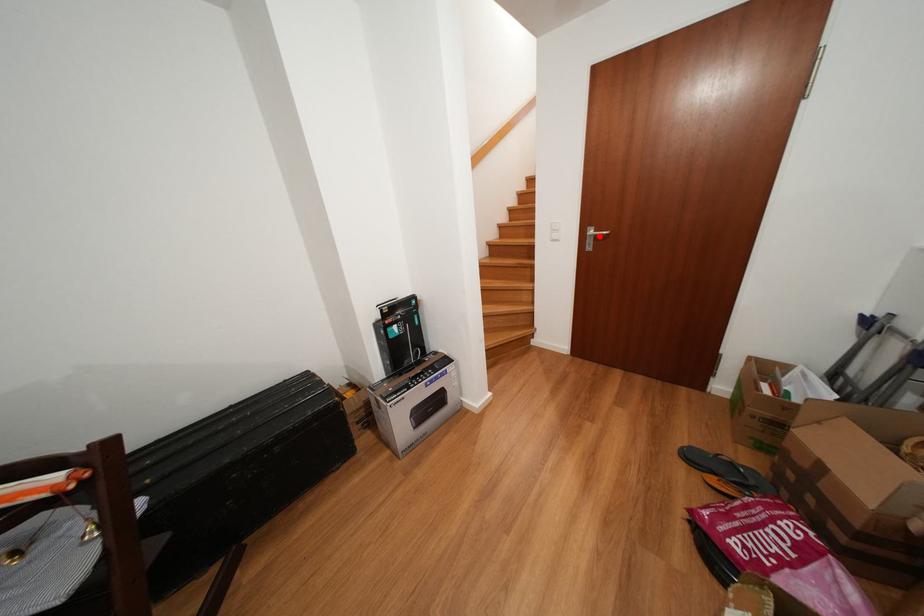
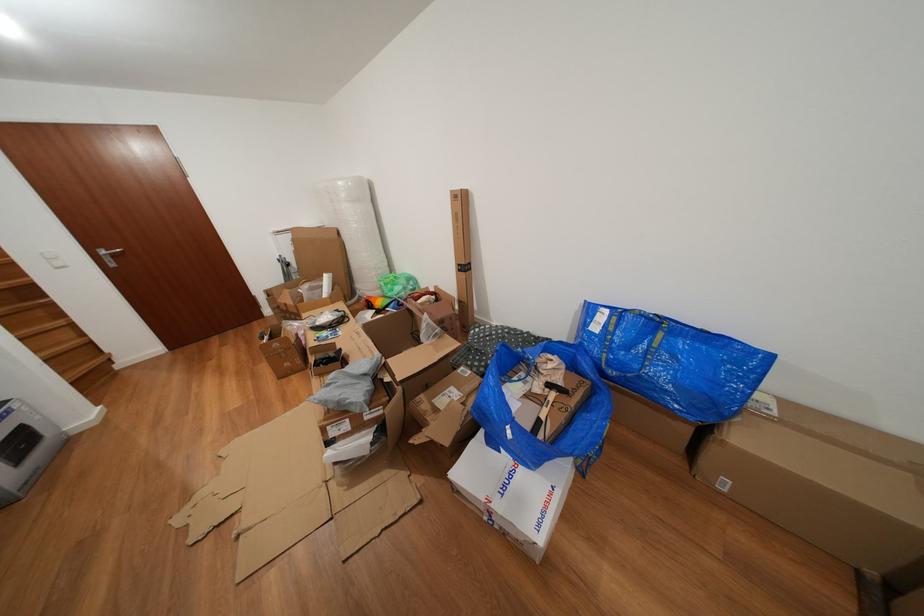
Find the pixel in the second image that matches the highlighted location in the first image.

(112, 257)